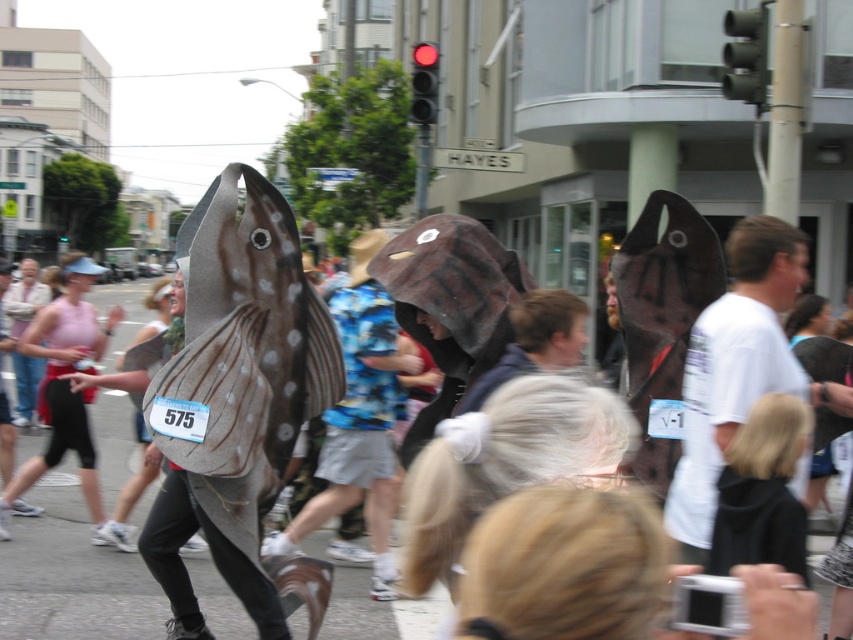
Question: Does white matte fish at right have a larger size compared to pink fabric tank top at left?

Choices:
 (A) yes
 (B) no

Answer: (B)

Question: Can you confirm if white matte fish at right is smaller than spotted leather shark at center?

Choices:
 (A) no
 (B) yes

Answer: (B)

Question: Among these objects, which one is farthest from the camera?

Choices:
 (A) white matte fish at right
 (B) pink fabric tank top at left
 (C) spotted leather shark at center

Answer: (C)

Question: Is white matte fish at right below spotted leather shark at center?

Choices:
 (A) yes
 (B) no

Answer: (B)

Question: Which is farther from the white matte fish at right?

Choices:
 (A) pink fabric tank top at left
 (B) spotted leather shark at center

Answer: (A)

Question: Considering the real-world distances, which object is closest to the spotted leather shark at center?

Choices:
 (A) white matte fish at right
 (B) pink fabric tank top at left

Answer: (B)